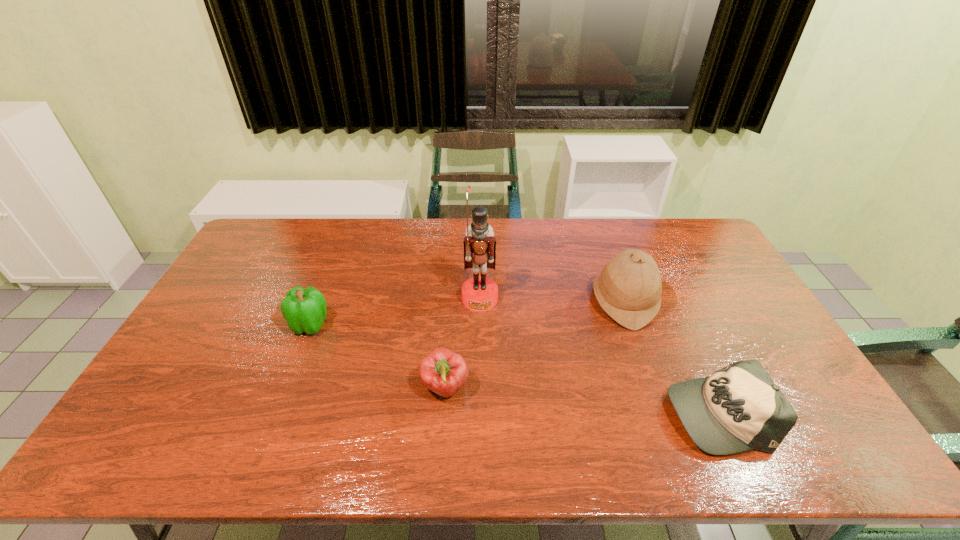
Where is `vacant point located between the nutcracker and the nearer bell pepper`? vacant point located between the nutcracker and the nearer bell pepper is located at coordinates (463, 343).

What are the coordinates of `vacant space that's between the baseball cap and the farther bell pepper` in the screenshot? It's located at (514, 369).

Find the location of `free space between the farther bell pepper and the nutcracker`. free space between the farther bell pepper and the nutcracker is located at coordinates (396, 312).

Find the location of a particular element. This screenshot has height=540, width=960. unoccupied position between the tallest object and the fourth shortest object is located at coordinates (552, 300).

Identify which object is the closest to the farther bell pepper. Please provide its 2D coordinates. Your answer should be formatted as a tuple, i.e. [(x, y)], where the tuple contains the x and y coordinates of a point satisfying the conditions above.

[(444, 372)]

Locate an element on the screen. the fourth closest object to the hat is located at coordinates (304, 310).

The height and width of the screenshot is (540, 960). I want to click on free location that satisfies the following two spatial constraints: 1. on the front-facing side of the hat; 2. on the front side of the leftmost object, so click(632, 325).